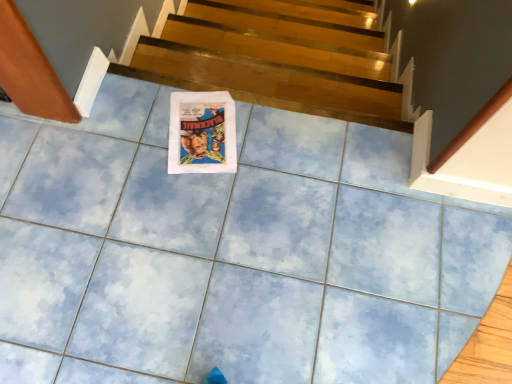
The height and width of the screenshot is (384, 512). Find the location of `empty space that is to the right of matte paper poster at center`. empty space that is to the right of matte paper poster at center is located at coordinates (269, 149).